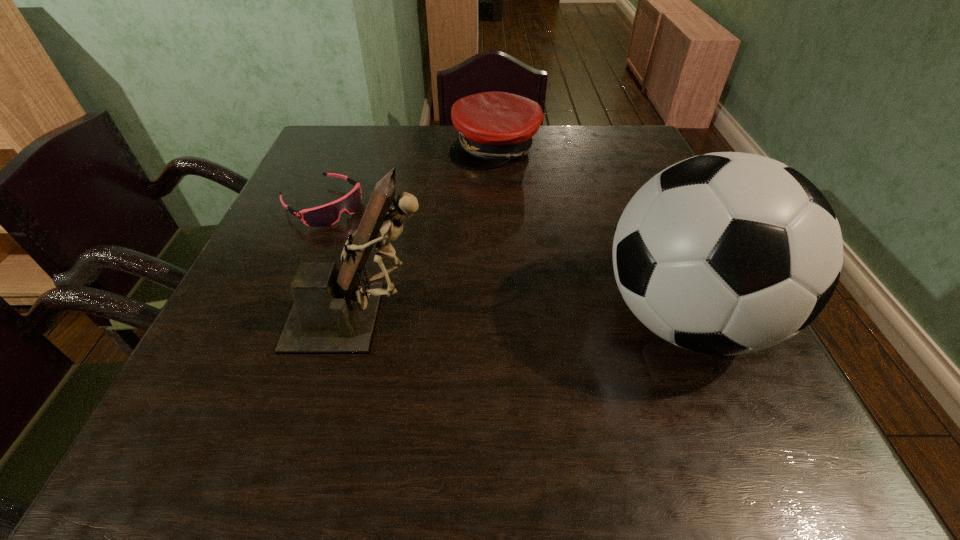
The image size is (960, 540). I want to click on free space that satisfies the following two spatial constraints: 1. on the front side of the soccer ball; 2. on the right side of the goggles, so click(274, 318).